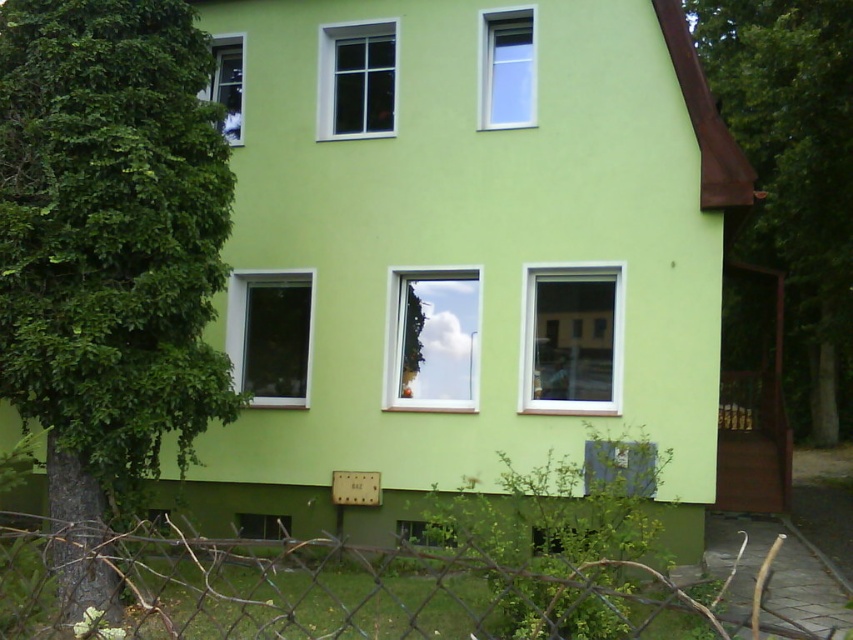
You are standing in front of the two story residential building. You want to locate the clear glass window at center right. Where would you look relative to the building?

The clear glass window at center right is located at the 2D coordinates point [572,339] on the building.

You are a delivery person trying to determine if your 3.5 meter long ladder can be placed diagonally between the green leafy tree at left and the transparent glass window at center without exceeding the space. Can you fit it there?

The distance between the green leafy tree at left and the transparent glass window at center is 3.31 meters. Since the ladder is 3.5 meters long, it is slightly longer than the available space. Therefore, the ladder cannot be placed diagonally between them without exceeding the space.

You are standing in front of the house and want to take a photo of the transparent glass window at center without the green leafy tree at left blocking the view. Which direction should you move to achieve this?

Move to the right so that the green leafy tree at left is no longer blocking the transparent glass window at center.